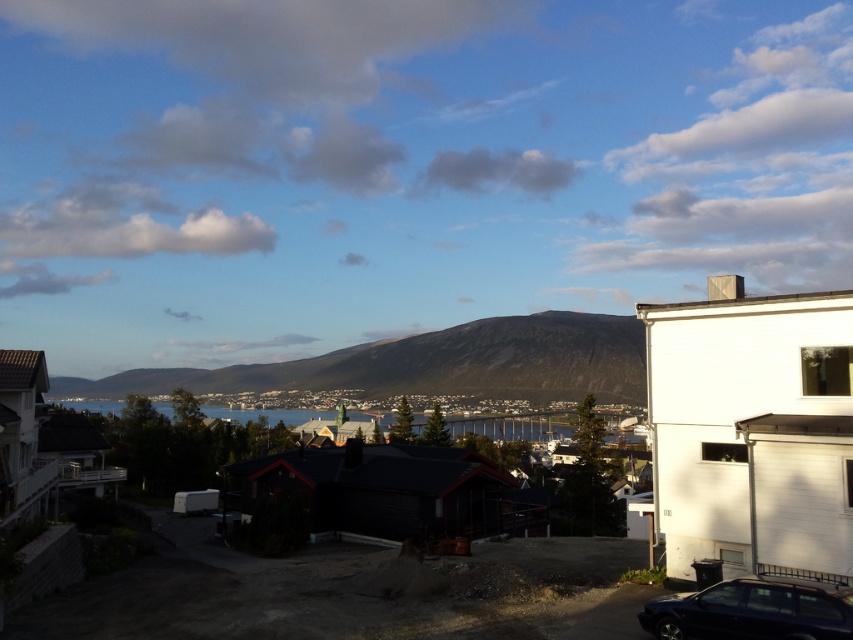
Question: Which object is positioned closest to the dark gray rocky mountain at center?

Choices:
 (A) blue water at center
 (B) shiny black car at lower right

Answer: (A)

Question: Does shiny black car at lower right have a smaller size compared to blue water at center?

Choices:
 (A) no
 (B) yes

Answer: (B)

Question: Is shiny black car at lower right smaller than blue water at center?

Choices:
 (A) yes
 (B) no

Answer: (A)

Question: Is dark gray rocky mountain at center positioned behind blue water at center?

Choices:
 (A) yes
 (B) no

Answer: (A)

Question: Considering the real-world distances, which object is closest to the blue water at center?

Choices:
 (A) dark gray rocky mountain at center
 (B) shiny black car at lower right

Answer: (A)

Question: Based on their relative distances, which object is nearer to the shiny black car at lower right?

Choices:
 (A) dark gray rocky mountain at center
 (B) blue water at center

Answer: (B)